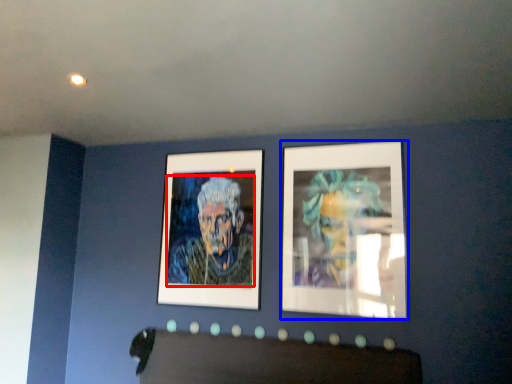
Question: Which object appears farthest to the camera in this image, person (highlighted by a red box) or picture frame (highlighted by a blue box)?

Choices:
 (A) person
 (B) picture frame

Answer: (A)